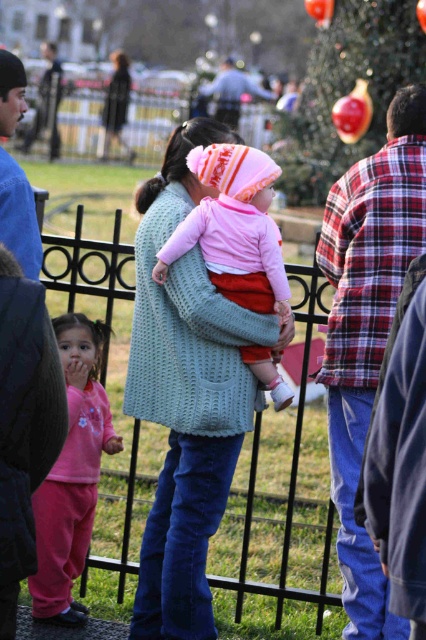
You are a photographer trying to capture the knitted light blue sweater at center in your shot. The camera you are using has a focal length of 50mm and an aperture of f2.8. You want to ensure that the sweater is in focus while the background Christmas tree is slightly blurred. Based on the coordinates provided, can you determine if the sweater is positioned within the depth of field range of the camera settings?

The knitted light blue sweater at center is positioned at point [187,396]. With a 50mm focal length and f2.8 aperture, the depth of field calculations would need to be done to confirm if the sweater falls within the in focus range while allowing the background Christmas tree to blur. However, without specific distance measurements between the sweater and the camera, or the distance to the Christmas tree, an exact determination cannot be made from the given coordinates alone.

You are a photographer trying to capture a photo of both the knitted light blue sweater at center and the matte pink sweater at center. Since you want to ensure both are fully visible in the frame, which sweater should you focus on first to avoid cropping the taller one?

The knitted light blue sweater at center is much taller than the matte pink sweater at center, so you should focus on ensuring the knitted light blue sweater at center is fully in frame first to avoid cropping it.